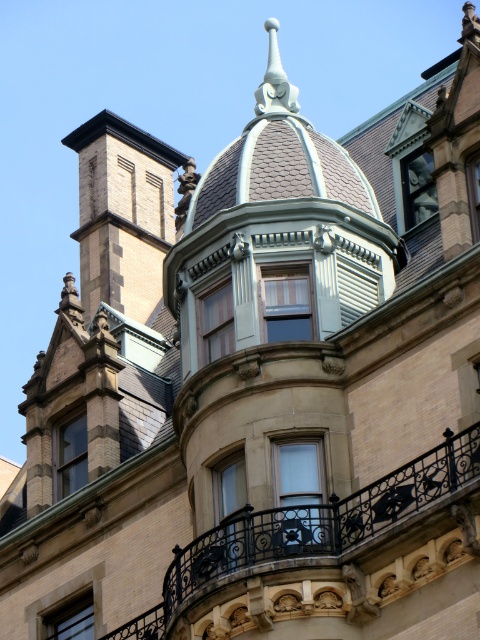
Where is `polished wrought iron balcony at center`? The height and width of the screenshot is (640, 480). polished wrought iron balcony at center is located at coordinates (321, 518).

Does polished wrought iron balcony at center appear on the right side of matte stone window at upper right?

In fact, polished wrought iron balcony at center is to the left of matte stone window at upper right.

Where is `polished wrought iron balcony at center`? The height and width of the screenshot is (640, 480). polished wrought iron balcony at center is located at coordinates click(321, 518).

Does polished wrought iron balcony at center have a lesser height compared to clear glass window at upper center?

No.

I want to click on polished wrought iron balcony at center, so click(x=321, y=518).

This screenshot has width=480, height=640. Find the location of `polished wrought iron balcony at center`. polished wrought iron balcony at center is located at coordinates (321, 518).

Can you confirm if polished wrought iron balcony at center is positioned to the right of white glass window at center?

Correct, you'll find polished wrought iron balcony at center to the right of white glass window at center.

Which is in front, point (458, 444) or point (294, 472)?

Point (458, 444)

Find the location of a particular element. polished wrought iron balcony at center is located at coordinates (321, 518).